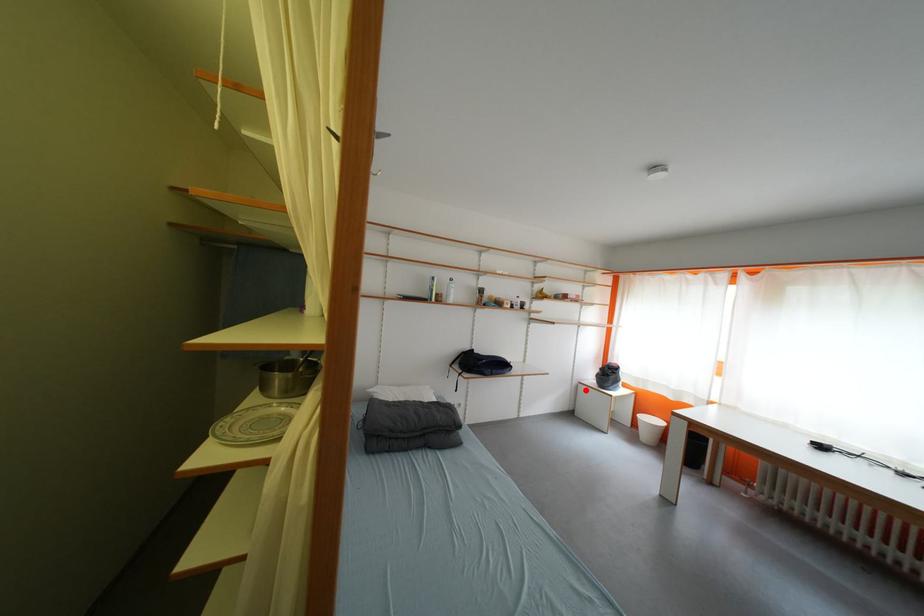
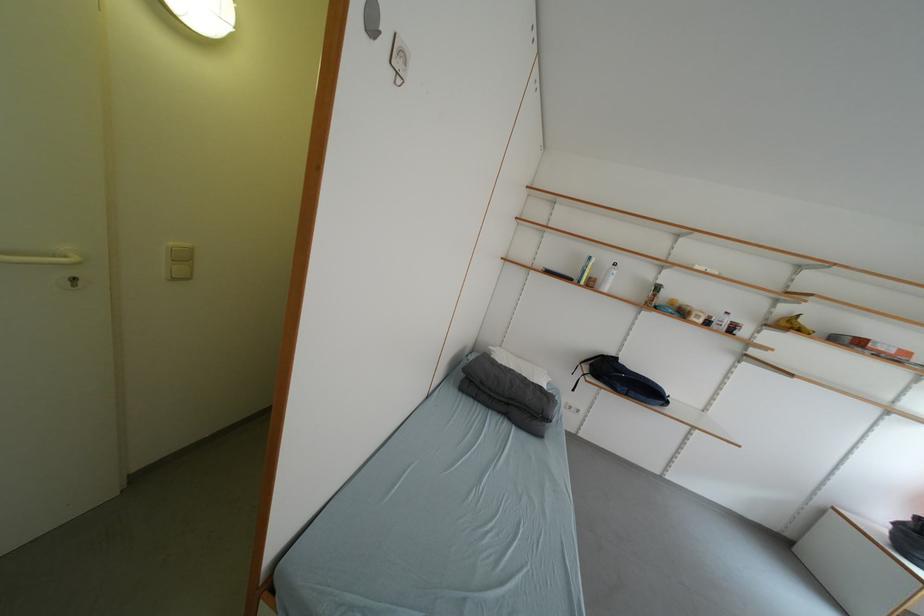
The point at the highlighted location is marked in the first image. Where is the corresponding point in the second image?

(832, 515)